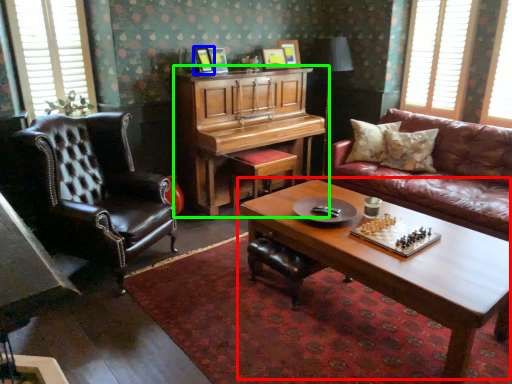
Question: Which is farther away from coffee table (highlighted by a red box)? picture frame (highlighted by a blue box) or piano (highlighted by a green box)?

Choices:
 (A) picture frame
 (B) piano

Answer: (A)